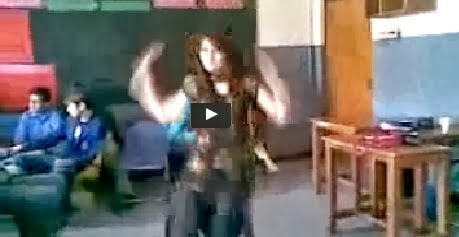
Identify the location of green wall background. (103, 40).